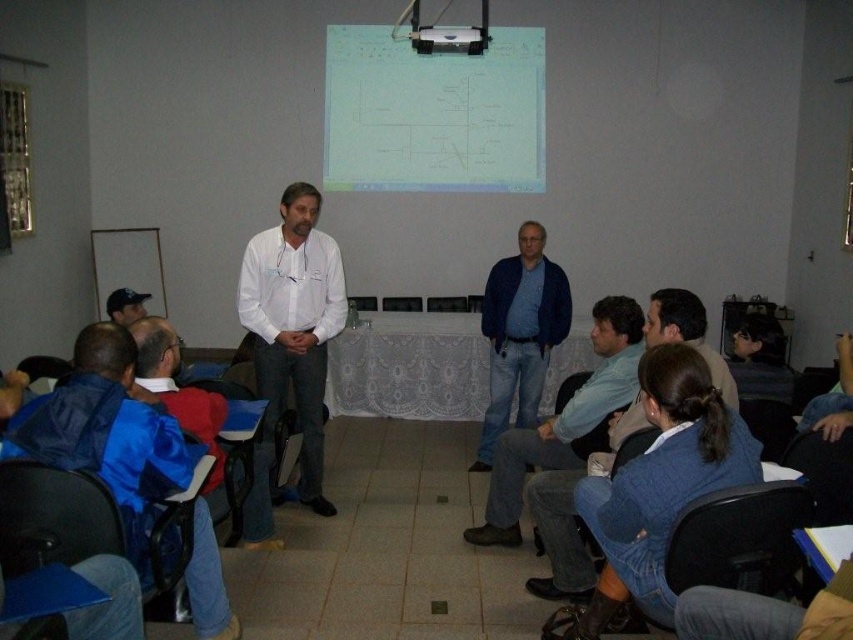
Can you confirm if blue denim jeans at center is positioned to the left of blue denim jeans at lower right?

Correct, you'll find blue denim jeans at center to the left of blue denim jeans at lower right.

Between blue denim jeans at center and blue denim jeans at lower right, which one appears on the left side from the viewer's perspective?

Positioned to the left is blue denim jeans at center.

Is point (488, 428) more distant than point (685, 320)?

Yes, point (488, 428) is farther from viewer.

The height and width of the screenshot is (640, 853). Identify the location of blue denim jeans at center. (520, 333).

Is blue denim jeans at center to the left of black plastic chair at lower right from the viewer's perspective?

Indeed, blue denim jeans at center is positioned on the left side of black plastic chair at lower right.

I want to click on blue denim jeans at center, so click(x=520, y=333).

Where is `white shirt at center`? This screenshot has height=640, width=853. white shirt at center is located at coordinates (293, 324).